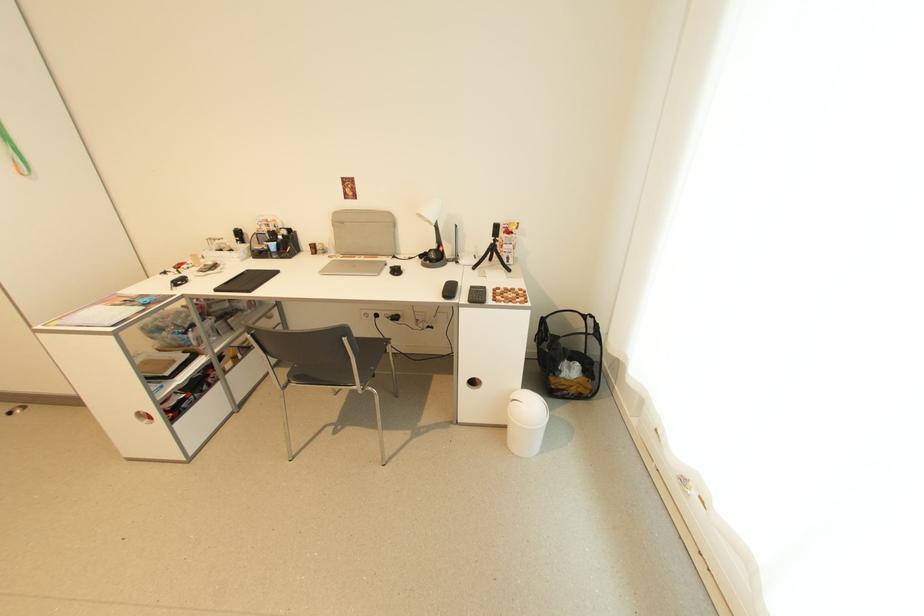
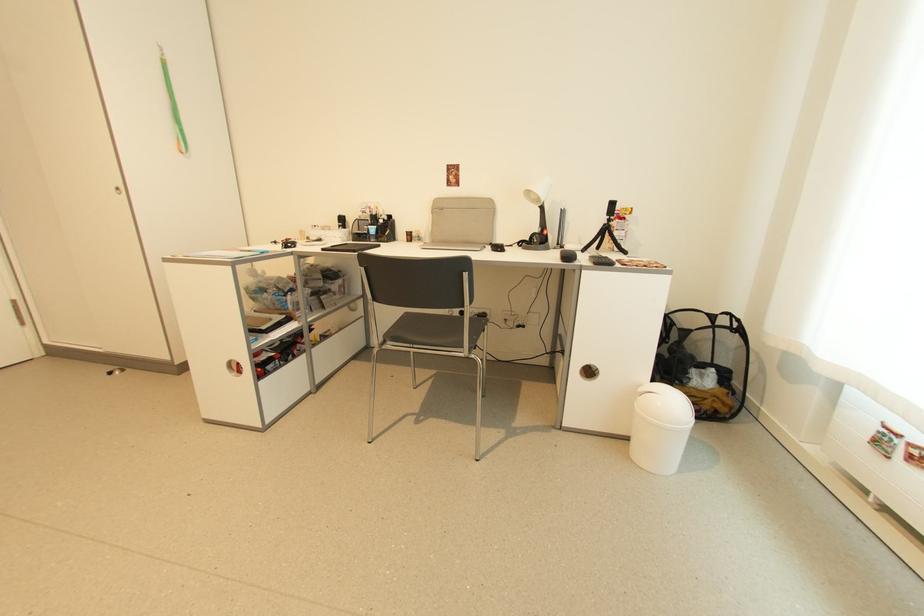
Find the pixel in the second image that matches [566,377] in the first image.

(697, 386)